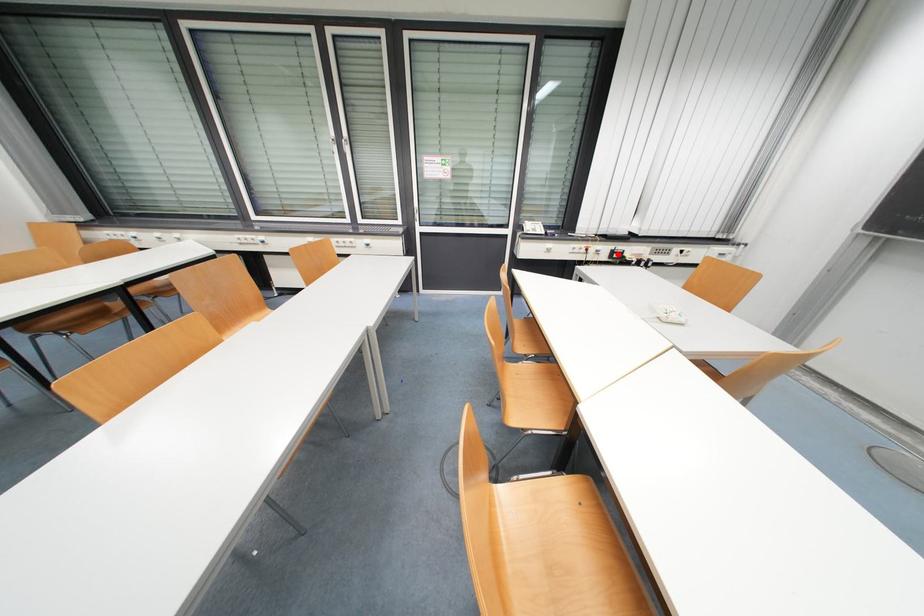
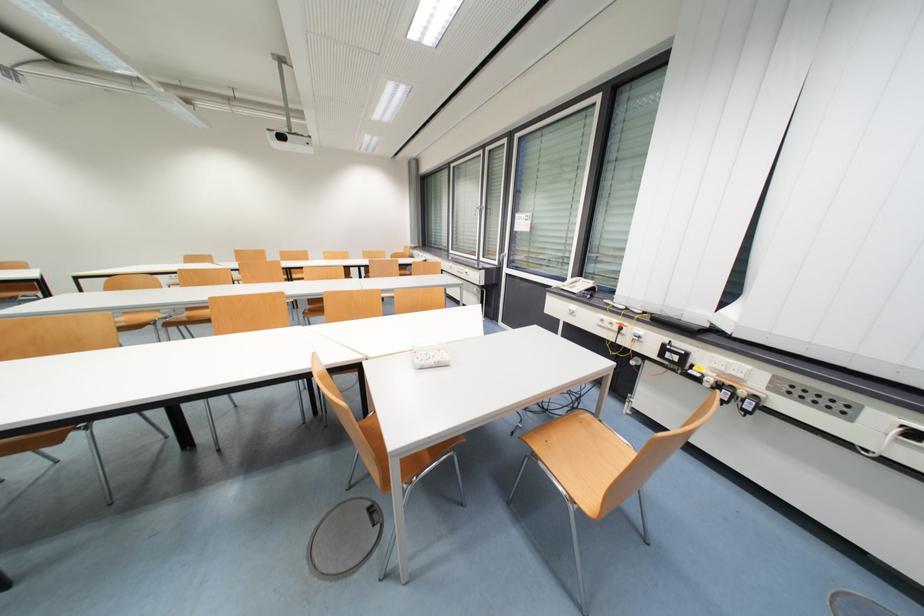
Question: I am providing you with two images of the same scene from different viewpoints. In image1, a red point is highlighted. Considering the same 3D point in image2, which of the following is correct?

Choices:
 (A) It is closer
 (B) It is farther

Answer: (B)